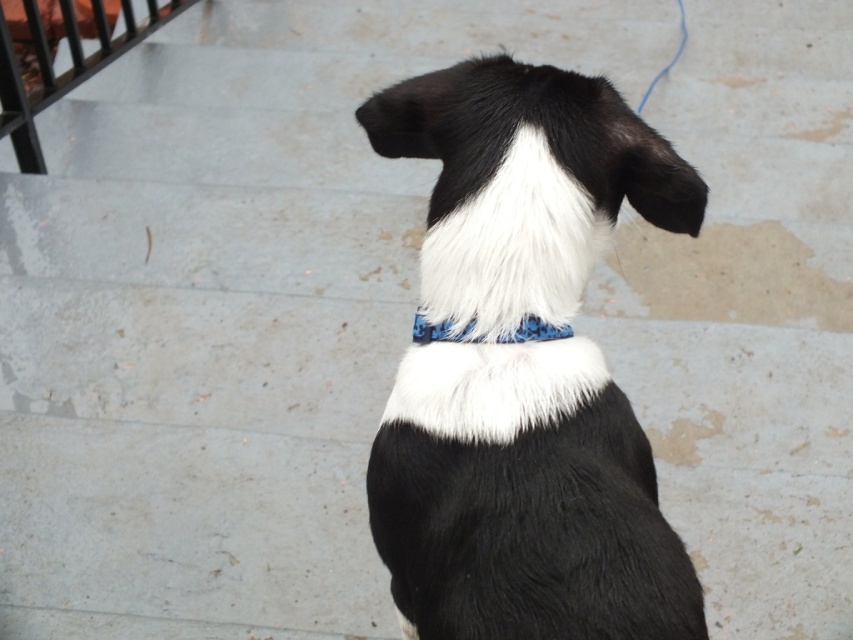
Question: Does black/white fur at center appear over blue camouflage fabric at center?

Choices:
 (A) yes
 (B) no

Answer: (B)

Question: Which point is farther to the camera?

Choices:
 (A) (421, 316)
 (B) (434, 512)

Answer: (A)

Question: Is the position of black/white fur at center more distant than that of blue camouflage fabric at center?

Choices:
 (A) no
 (B) yes

Answer: (A)

Question: Is black/white fur at center further to the viewer compared to blue camouflage fabric at center?

Choices:
 (A) no
 (B) yes

Answer: (A)

Question: Which point is closer to the camera?

Choices:
 (A) black/white fur at center
 (B) blue camouflage fabric at center

Answer: (A)